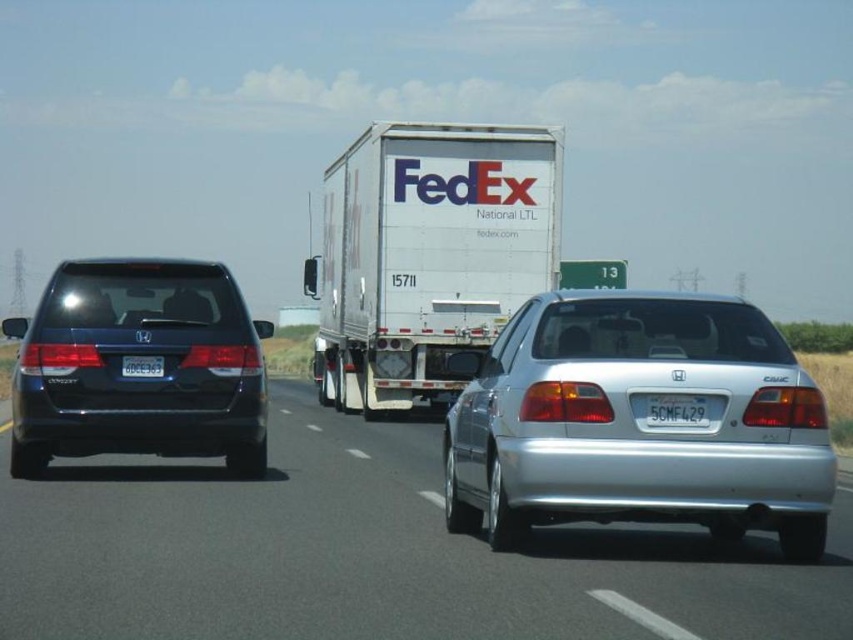
Question: Can you confirm if white matte fedex truck at center is wider than white plastic license plate at rear left?

Choices:
 (A) yes
 (B) no

Answer: (A)

Question: From the image, what is the correct spatial relationship of silver metallic car at center in relation to gray metallic license plate at center?

Choices:
 (A) right
 (B) left

Answer: (B)

Question: Among these objects, which one is nearest to the camera?

Choices:
 (A) silver metallic car at center
 (B) silver metallic sedan at center

Answer: (A)

Question: Is matte black minivan at left wider than white plastic license plate at rear left?

Choices:
 (A) yes
 (B) no

Answer: (A)

Question: Which object is closer to the camera taking this photo?

Choices:
 (A) white plastic license plate at rear left
 (B) white matte fedex truck at center

Answer: (A)

Question: Among these points, which one is nearest to the camera?

Choices:
 (A) (161, 369)
 (B) (167, 444)

Answer: (A)